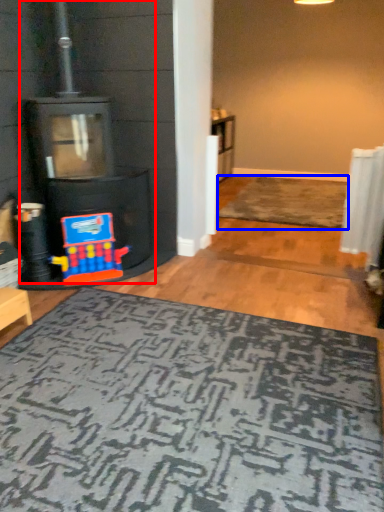
Question: Among these objects, which one is farthest to the camera, fireplace (highlighted by a red box) or doormat (highlighted by a blue box)?

Choices:
 (A) fireplace
 (B) doormat

Answer: (B)